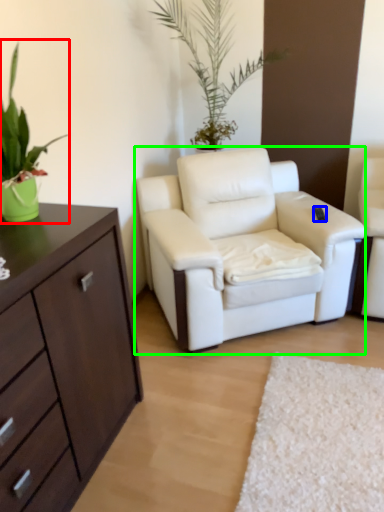
Question: Which object is positioned closest to houseplant (highlighted by a red box)? Select from remote control (highlighted by a blue box) and chair (highlighted by a green box).

Choices:
 (A) remote control
 (B) chair

Answer: (B)